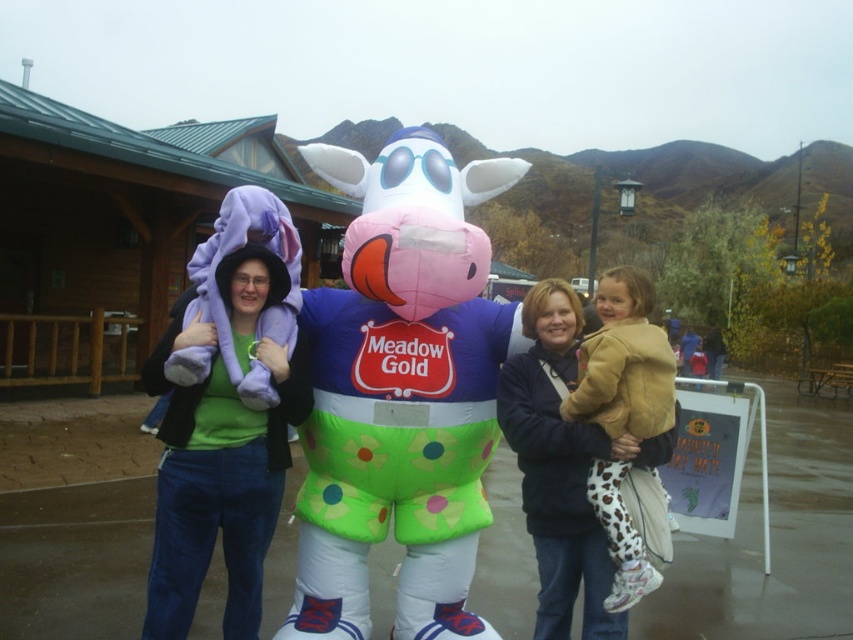
Question: Does purple fleece hat at left appear over light brown leather jacket at center?

Choices:
 (A) yes
 (B) no

Answer: (A)

Question: Which of the following is the closest to the observer?

Choices:
 (A) inflatable pink and green at center
 (B) purple fleece hat at left

Answer: (B)

Question: Which object is farther from the camera taking this photo?

Choices:
 (A) inflatable pink and green at center
 (B) purple fleece hat at left
 (C) matte black jacket at center

Answer: (C)

Question: Observing the image, what is the correct spatial positioning of inflatable pink and green at center in reference to purple fleece hat at left?

Choices:
 (A) left
 (B) right

Answer: (B)

Question: Does inflatable pink and green at center appear on the right side of purple fleece hat at left?

Choices:
 (A) yes
 (B) no

Answer: (A)

Question: Among these points, which one is farthest from the camera?

Choices:
 (A) (144, 621)
 (B) (608, 307)

Answer: (B)